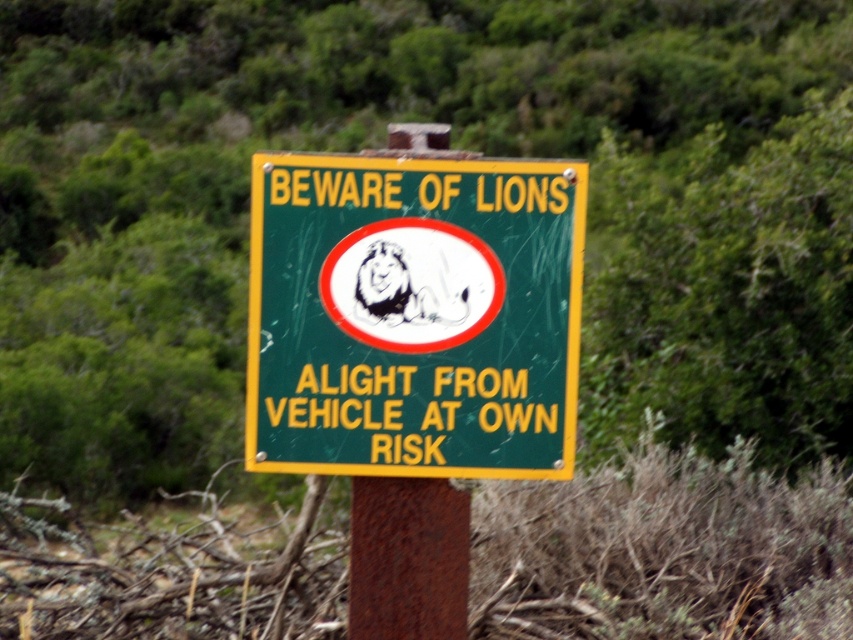
Does point (386, 525) come in front of point (457, 536)?

Yes, it is.

Is rusty metal pole at center further to the viewer compared to rusty metal post at center?

Yes, rusty metal pole at center is further from the viewer.

Looking at this image, who is more distant from viewer, (424,480) or (450,550)?

Positioned behind is point (450,550).

At what (x,y) coordinates should I click in order to perform the action: click on rusty metal pole at center. Please return your answer as a coordinate pair (x, y). Looking at the image, I should click on (407, 557).

Image resolution: width=853 pixels, height=640 pixels. In order to click on green matte sign at center in this screenshot , I will do point(413,316).

Find the location of a particular element. green matte sign at center is located at coordinates (413, 316).

Is the position of green matte sign at center less distant than that of rusty metal pole at center?

Yes, green matte sign at center is closer to the viewer.

Where is `green matte sign at center`? The width and height of the screenshot is (853, 640). green matte sign at center is located at coordinates (413, 316).

This screenshot has width=853, height=640. I want to click on green matte sign at center, so click(413, 316).